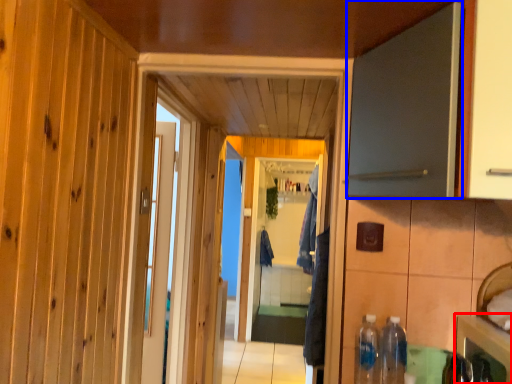
Question: Which point is closer to the camera, cabinetry (highlighted by a red box) or door (highlighted by a blue box)?

Choices:
 (A) cabinetry
 (B) door

Answer: (B)